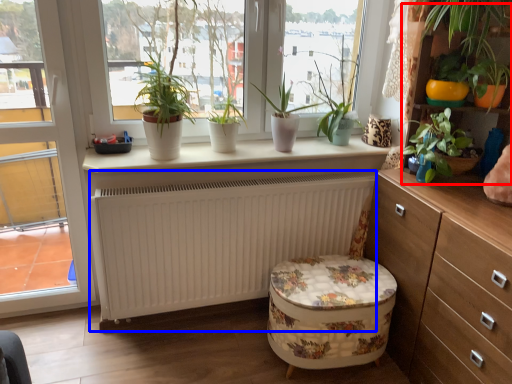
Question: Among these objects, which one is farthest to the camera, bookshelf (highlighted by a red box) or radiator (highlighted by a blue box)?

Choices:
 (A) bookshelf
 (B) radiator

Answer: (B)